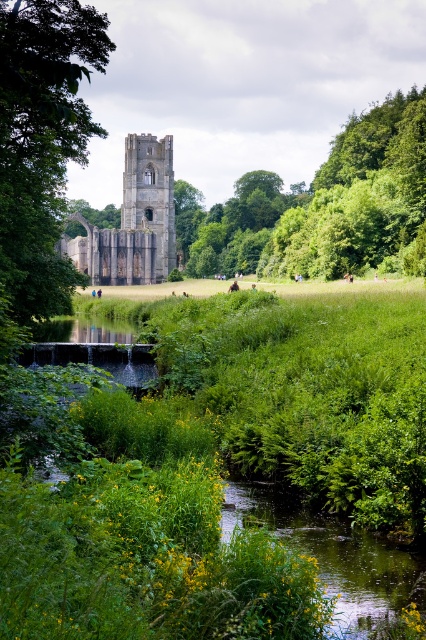
Question: Considering the real-world distances, which object is farthest from the green leafy tree at center?

Choices:
 (A) green leafy water at lower center
 (B) green leafy tree at upper left

Answer: (A)

Question: Which point appears farthest from the camera in this image?

Choices:
 (A) (154, 262)
 (B) (63, 205)

Answer: (A)

Question: Which of these objects is positioned farthest from the green leafy tree at center?

Choices:
 (A) green leafy tree at upper left
 (B) stone tower at center
 (C) green leafy water at lower center
 (D) dark gray stone tower at center

Answer: (C)

Question: Can you confirm if green leafy tree at center is bigger than dark gray stone tower at center?

Choices:
 (A) yes
 (B) no

Answer: (A)

Question: From the image, what is the correct spatial relationship of green leafy tree at center in relation to green leafy water at lower center?

Choices:
 (A) below
 (B) above

Answer: (B)

Question: Is green leafy tree at center positioned at the back of stone tower at center?

Choices:
 (A) no
 (B) yes

Answer: (A)